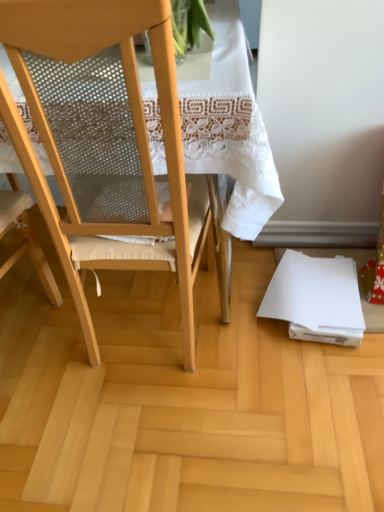
This screenshot has width=384, height=512. What are the coordinates of `vacant space in between matte wood chair at center and white paper at lower right` in the screenshot? It's located at (247, 320).